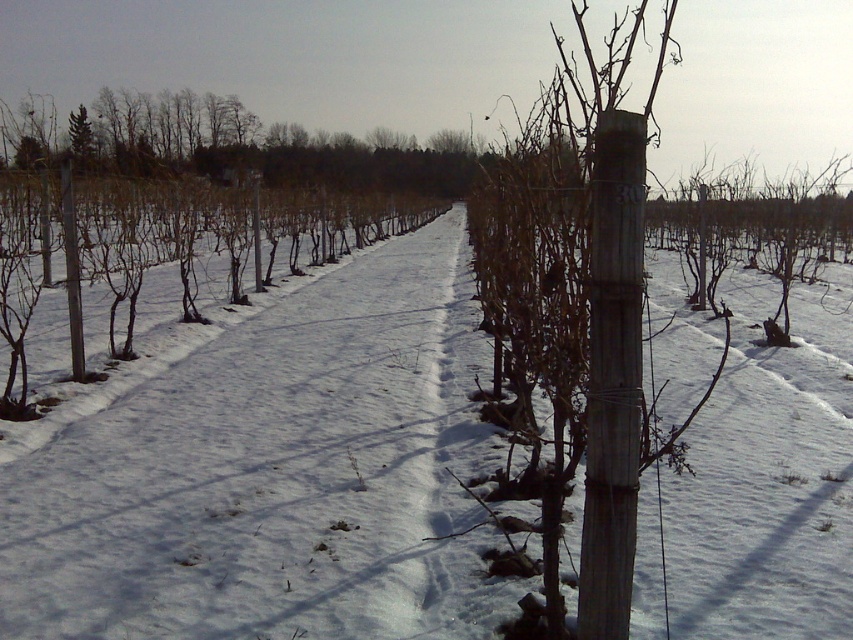
Is point (601, 232) positioned after point (70, 182)?

No, (601, 232) is in front of (70, 182).

At what (x,y) coordinates should I click in order to perform the action: click on wooden post at center. Please return your answer as a coordinate pair (x, y). The height and width of the screenshot is (640, 853). Looking at the image, I should click on (613, 378).

Who is more forward, (610, 321) or (73, 340)?

Positioned in front is point (610, 321).

At what (x,y) coordinates should I click in order to perform the action: click on wooden post at center. Please return your answer as a coordinate pair (x, y). This screenshot has width=853, height=640. Looking at the image, I should click on (613, 378).

Measure the distance between white powdery snow at center and camera.

7.74 feet

Between point (445, 544) and point (79, 272), which one is positioned behind?

Point (79, 272)

Which is in front, point (322, 595) or point (68, 205)?

Point (322, 595) is more forward.

Where is `white powdery snow at center`? The height and width of the screenshot is (640, 853). white powdery snow at center is located at coordinates (277, 474).

Is white powdery snow at center in front of wooden post at center?

No.

Measure the distance between point (x=813, y=387) and camera.

Point (x=813, y=387) and camera are 5.49 meters apart.

You are a GUI agent. You are given a task and a screenshot of the screen. Output one action in this format:
    pyautogui.click(x=<x>, y=<y>)
    Task: Click on the white powdery snow at center
    
    Given the screenshot: What is the action you would take?
    pyautogui.click(x=277, y=474)